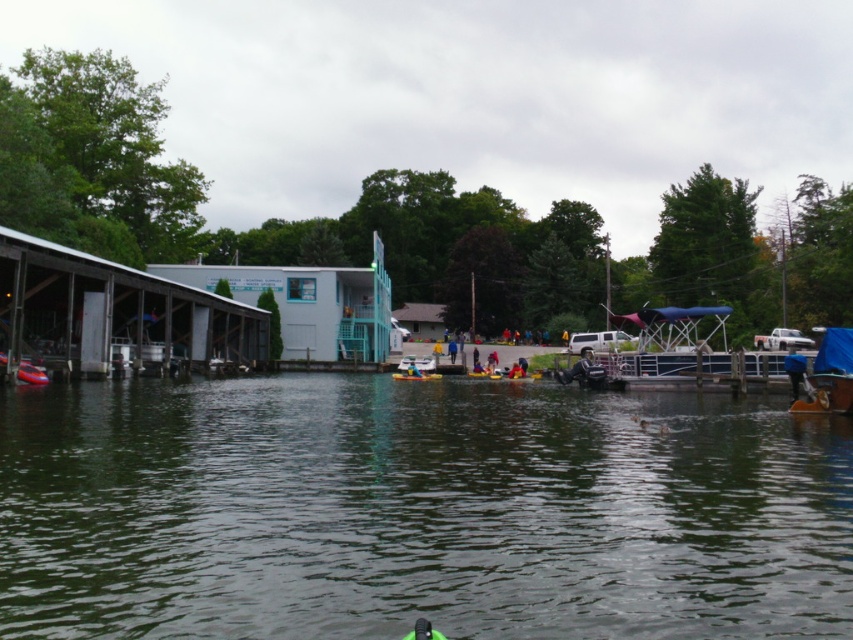
Measure the distance between point (169, 556) and camera.

Point (169, 556) is 8.12 meters away from camera.

Which is in front, point (664, 531) or point (445, 637)?

Point (445, 637)

Which is behind, point (251, 520) or point (437, 632)?

The point (251, 520) is more distant.

The height and width of the screenshot is (640, 853). Identify the location of green water at center. (416, 512).

Which is below, yellow plastic canoe at center or yellow fabric kayak at center?

yellow plastic canoe at center is lower down.

Is the position of yellow plastic canoe at center less distant than that of yellow fabric kayak at center?

No, yellow plastic canoe at center is behind yellow fabric kayak at center.

Is point (486, 376) more distant than point (421, 376)?

That is True.

Find the location of a particular element. yellow plastic canoe at center is located at coordinates (485, 374).

Is green water at center taller than yellow fabric kayak at center?

No, green water at center is not taller than yellow fabric kayak at center.

Between green water at center and yellow fabric kayak at center, which one is positioned lower?

Positioned lower is yellow fabric kayak at center.

Is point (796, 577) farther from viewer compared to point (410, 365)?

No, (796, 577) is closer to viewer.

Find the location of a particular element. green water at center is located at coordinates (416, 512).